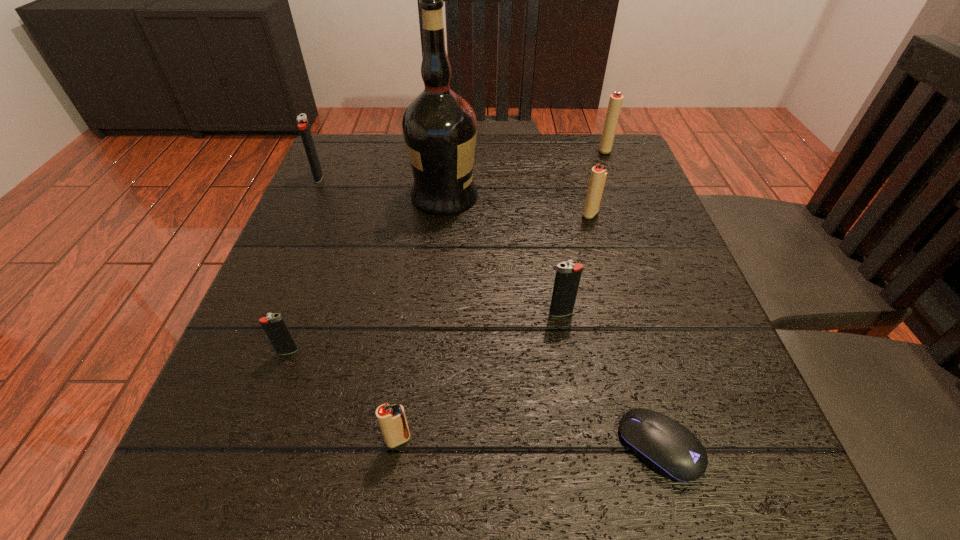
The width and height of the screenshot is (960, 540). Find the location of `vacant space at the far edge of the desktop`. vacant space at the far edge of the desktop is located at coordinates (475, 166).

Image resolution: width=960 pixels, height=540 pixels. Identify the location of free point at the near edge. (429, 463).

Locate an element on the screen. The width and height of the screenshot is (960, 540). free space at the left edge of the desktop is located at coordinates (322, 299).

The height and width of the screenshot is (540, 960). Find the location of `free location at the right edge of the desktop`. free location at the right edge of the desktop is located at coordinates (718, 347).

Image resolution: width=960 pixels, height=540 pixels. I want to click on vacant space at the far left corner of the desktop, so click(x=371, y=171).

Where is `vacant space at the far right corner of the desktop`? Image resolution: width=960 pixels, height=540 pixels. vacant space at the far right corner of the desktop is located at coordinates (620, 133).

Locate an element on the screen. The height and width of the screenshot is (540, 960). free space at the near right corner is located at coordinates (718, 501).

In order to click on vacant area between the second red igniter from right to left and the liquor in this screenshot , I will do `click(517, 205)`.

The width and height of the screenshot is (960, 540). In order to click on free point between the farthest object and the smallest black igniter in this screenshot , I will do `click(446, 251)`.

This screenshot has height=540, width=960. Find the location of `free space between the farthest red igniter and the smallest black igniter`. free space between the farthest red igniter and the smallest black igniter is located at coordinates (446, 251).